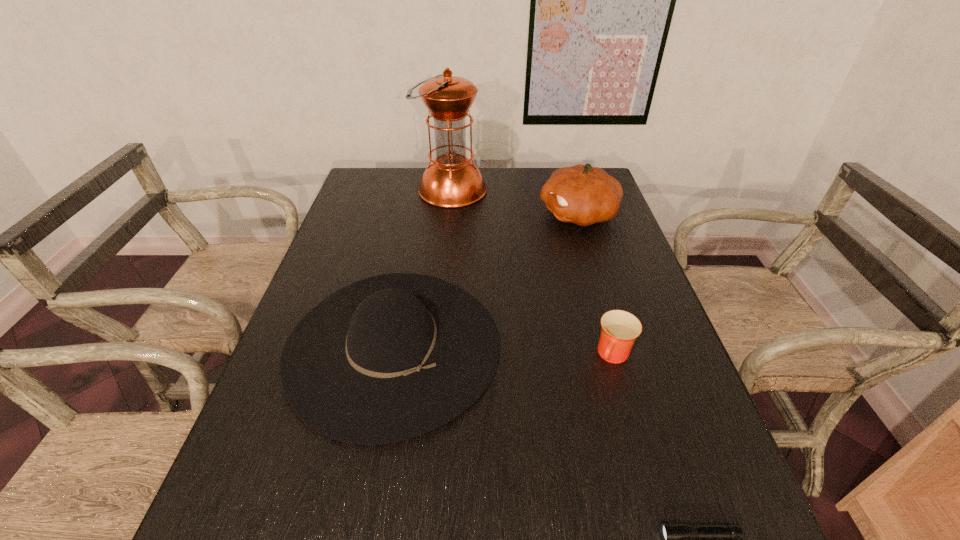
At what (x,y) coordinates should I click in order to perform the action: click on vacant area that satisfies the following two spatial constraints: 1. on the front face of the fourth shortest object; 2. on the front-facing side of the third tallest object. Please return your answer as a coordinate pair (x, y). Looking at the image, I should click on (618, 346).

This screenshot has height=540, width=960. Identify the location of free space in the image that satisfies the following two spatial constraints: 1. on the front face of the pumpkin; 2. on the front-facing side of the sombrero. click(618, 346).

Where is `blank area in the image that satisfies the following two spatial constraints: 1. on the front face of the second tallest object; 2. on the front-facing side of the third tallest object`? This screenshot has width=960, height=540. blank area in the image that satisfies the following two spatial constraints: 1. on the front face of the second tallest object; 2. on the front-facing side of the third tallest object is located at coordinates (618, 346).

I want to click on vacant space that satisfies the following two spatial constraints: 1. on the front side of the oil lamp; 2. on the left side of the second shortest object, so click(x=437, y=356).